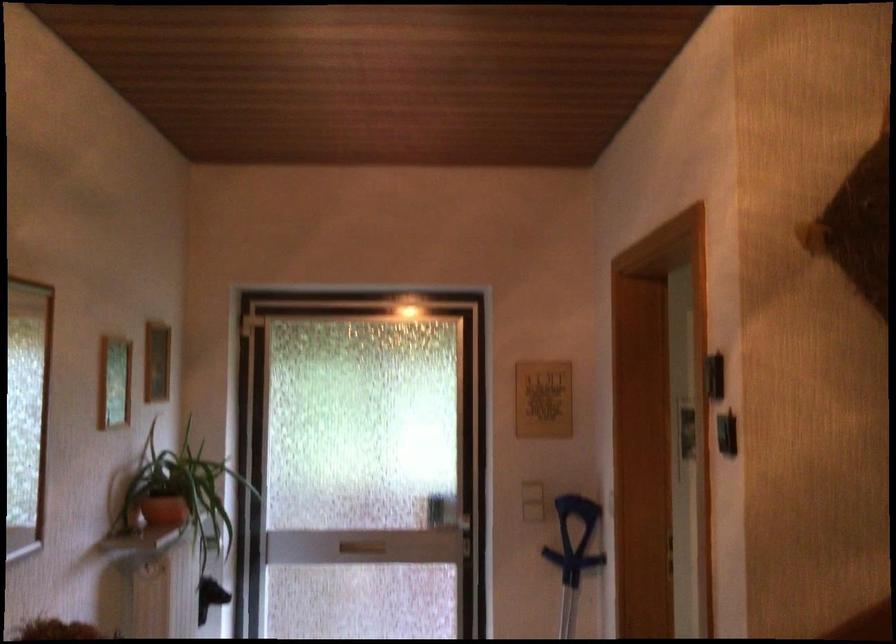
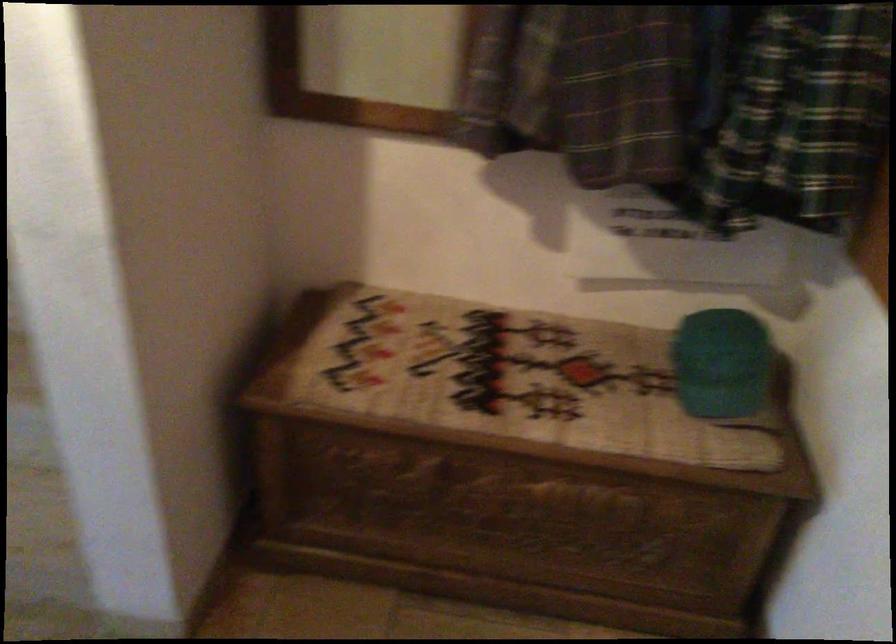
The first image is from the beginning of the video and the second image is from the end. How did the camera likely rotate when shooting the video?

The rotation direction of the camera is right-down.